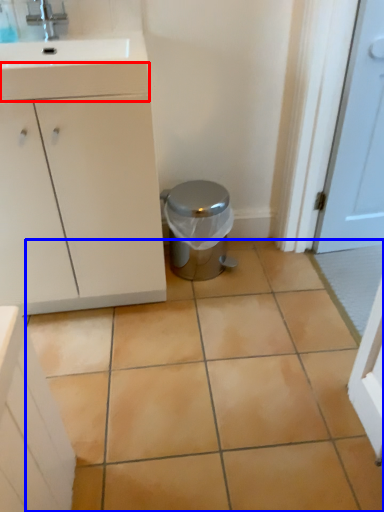
Question: Which object is closer to the camera taking this photo, drawer (highlighted by a red box) or ceramic tile (highlighted by a blue box)?

Choices:
 (A) drawer
 (B) ceramic tile

Answer: (B)